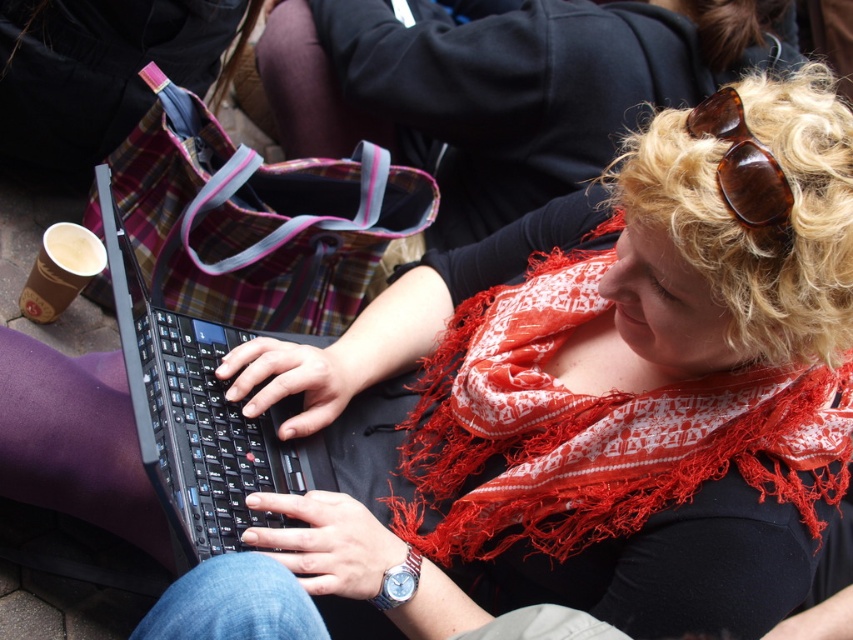
Which is below, red fringed scarf at center or tortoiseshell sunglasses at upper right?

red fringed scarf at center is below.

Is red fringed scarf at center further to the viewer compared to tortoiseshell sunglasses at upper right?

Yes, it is behind tortoiseshell sunglasses at upper right.

Locate an element on the screen. The height and width of the screenshot is (640, 853). red fringed scarf at center is located at coordinates (595, 429).

Which of these two, red fringed scarf at center or black plastic laptop at center, stands shorter?

With less height is red fringed scarf at center.

Which is behind, point (564, 556) or point (299, 460)?

Point (299, 460)

Identify the location of red fringed scarf at center. This screenshot has height=640, width=853. (595, 429).

Is point (120, 296) behind point (728, 177)?

Yes.

Where is `black plastic laptop at center`? This screenshot has width=853, height=640. black plastic laptop at center is located at coordinates (193, 410).